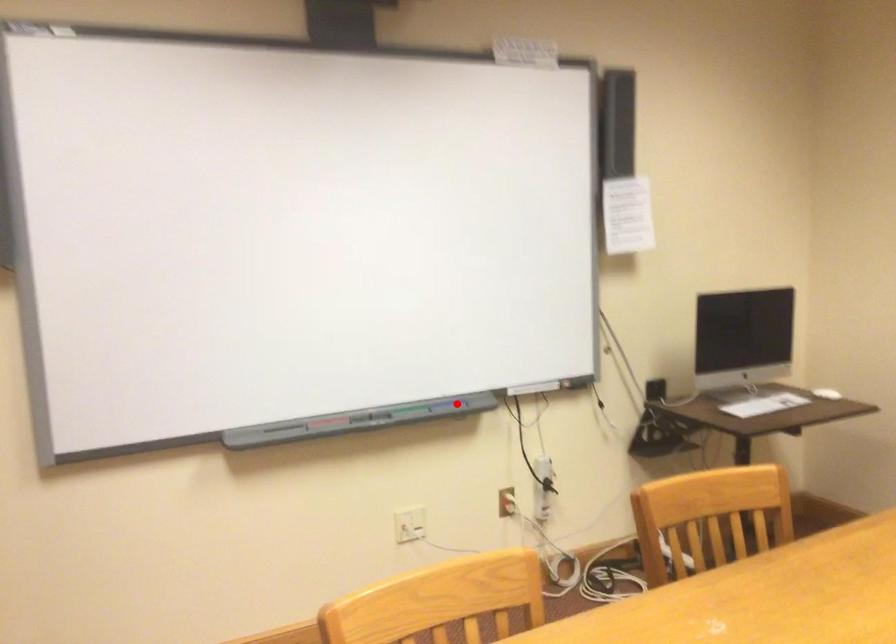
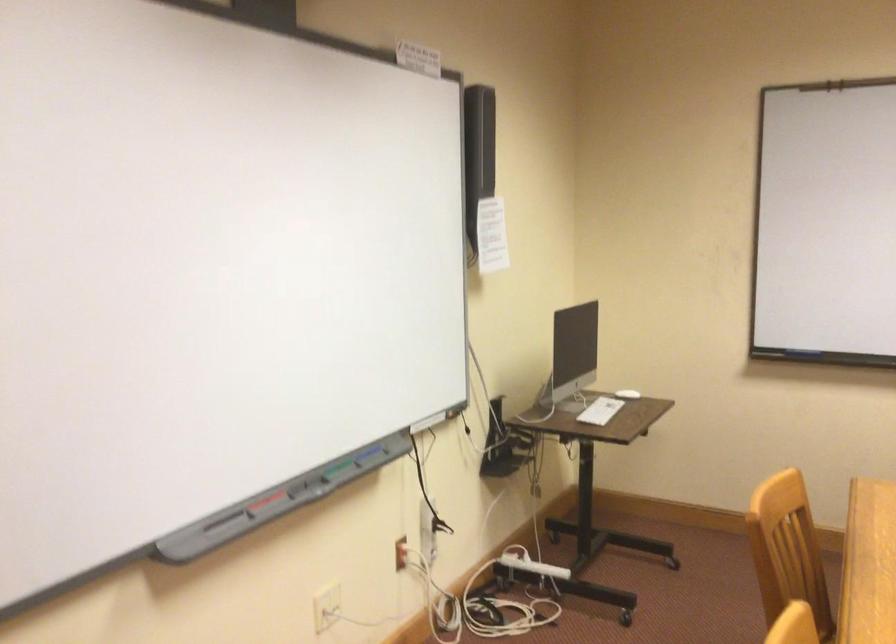
The point at the highlighted location is marked in the first image. Where is the corresponding point in the second image?

(368, 453)